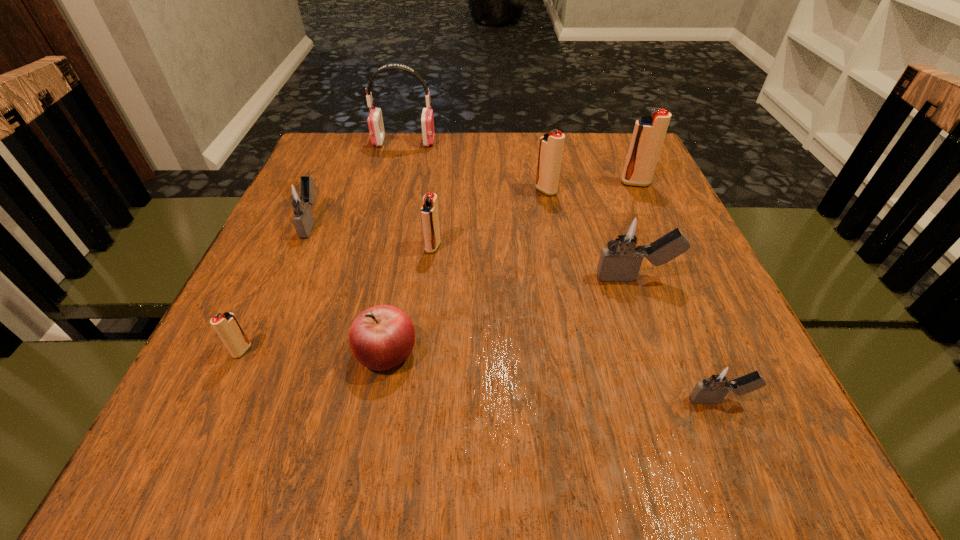
You are a GUI agent. You are given a task and a screenshot of the screen. Output one action in this format:
    pyautogui.click(x=<x>, y=<y>)
    Task: Click on the earphone
    This screenshot has width=960, height=540.
    Given the screenshot: What is the action you would take?
    pyautogui.click(x=375, y=120)

Locate an element on the screen. Image resolution: width=960 pixels, height=540 pixels. the farthest object is located at coordinates (375, 120).

Where is `the biggest red igniter`? The width and height of the screenshot is (960, 540). the biggest red igniter is located at coordinates pyautogui.click(x=649, y=132).

Identify the location of the tallest igniter. The image size is (960, 540). (649, 132).

The height and width of the screenshot is (540, 960). Find the location of `the third red igniter from left to right`. the third red igniter from left to right is located at coordinates (551, 144).

Where is `the fourth object from right to left`? The width and height of the screenshot is (960, 540). the fourth object from right to left is located at coordinates point(551,144).

I want to click on the sixth farthest object, so click(628, 234).

What are the coordinates of `the third nearest igniter` in the screenshot? It's located at (628, 234).

Where is `the third farthest igniter`? The width and height of the screenshot is (960, 540). the third farthest igniter is located at coordinates (300, 196).

The height and width of the screenshot is (540, 960). I want to click on the second smallest gray igniter, so click(300, 196).